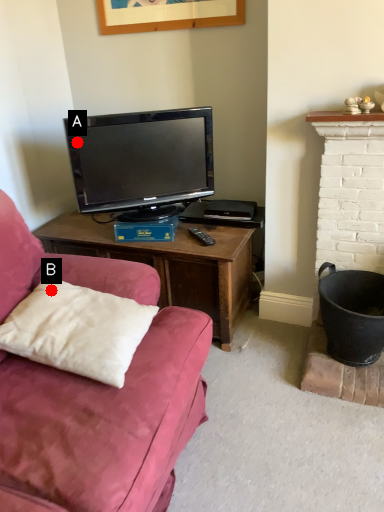
Question: Two points are circled on the image, labeled by A and B beside each circle. Which point appears closest to the camera in this image?

Choices:
 (A) A is closer
 (B) B is closer

Answer: (B)